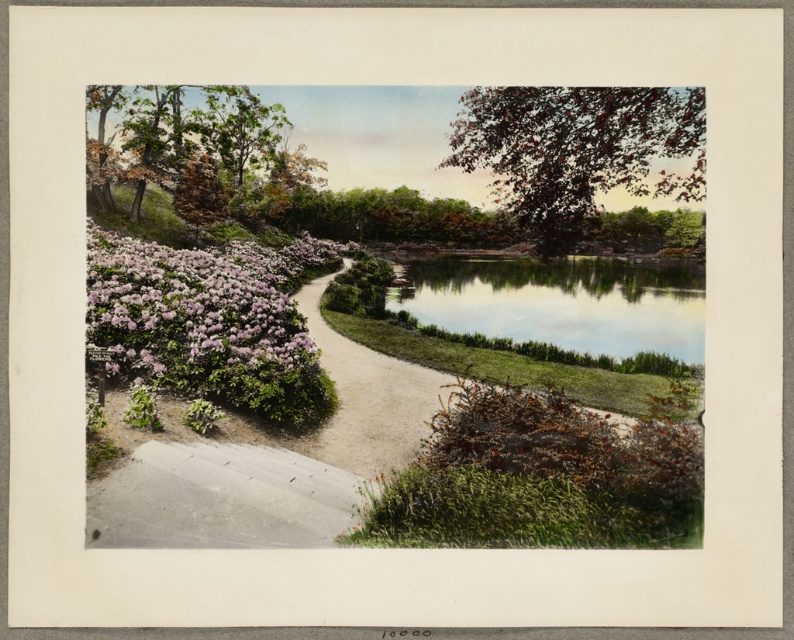
You are standing at the garden entrance and want to reach the smooth brown tree at upper right. The garden has a 10 meter wide path. Will you need to walk beyond the path to reach the tree?

The smooth brown tree at upper right is 14.07 meters away from the viewer. Since the path is only 10 meters wide, you will need to walk beyond the path to reach the tree.

You are a gardener planning to place a large decorative statue that requires a 3x3 meter space. Based on the scene, which object between the smooth brown tree at upper right and the sandy gravel path at center would be more suitable for placing the statue?

The sandy gravel path at center is more suitable for placing the statue since the smooth brown tree at upper right is larger in size and may not have enough space around it for the statue.